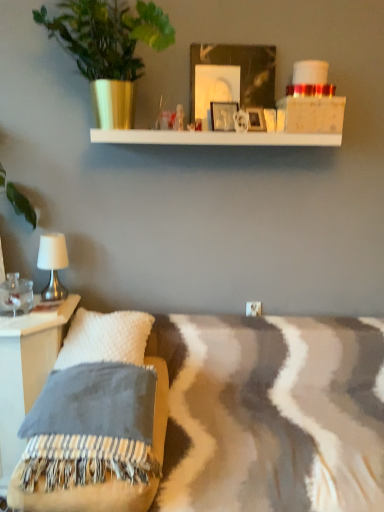
Question: From the image's perspective, is green leafy plant in gold pot at upper left located beneath white fuzzy pillow at lower left?

Choices:
 (A) yes
 (B) no

Answer: (B)

Question: Considering the relative sizes of green leafy plant in gold pot at upper left and white fuzzy pillow at lower left in the image provided, is green leafy plant in gold pot at upper left taller than white fuzzy pillow at lower left?

Choices:
 (A) no
 (B) yes

Answer: (B)

Question: Does green leafy plant in gold pot at upper left have a lesser width compared to white fuzzy pillow at lower left?

Choices:
 (A) yes
 (B) no

Answer: (B)

Question: Could you tell me if green leafy plant in gold pot at upper left is turned towards white fuzzy pillow at lower left?

Choices:
 (A) no
 (B) yes

Answer: (A)

Question: Does green leafy plant in gold pot at upper left appear on the right side of white fuzzy pillow at lower left?

Choices:
 (A) yes
 (B) no

Answer: (A)

Question: Would you say green leafy plant in gold pot at upper left is a long distance from white fuzzy pillow at lower left?

Choices:
 (A) no
 (B) yes

Answer: (B)

Question: Is silver metallic table lamp at left aimed at metallic silver picture frame at upper center, the first picture frame viewed from the right?

Choices:
 (A) yes
 (B) no

Answer: (B)

Question: Is silver metallic table lamp at left positioned before metallic silver picture frame at upper center, which appears as the 2th picture frame when viewed from the left?

Choices:
 (A) yes
 (B) no

Answer: (B)

Question: Does silver metallic table lamp at left have a smaller size compared to metallic silver picture frame at upper center, which appears as the 2th picture frame when viewed from the left?

Choices:
 (A) yes
 (B) no

Answer: (B)

Question: From a real-world perspective, is silver metallic table lamp at left on top of metallic silver picture frame at upper center, which appears as the 2th picture frame when viewed from the left?

Choices:
 (A) yes
 (B) no

Answer: (B)

Question: Would you say metallic silver picture frame at upper center, the first picture frame viewed from the right, is part of silver metallic table lamp at left's contents?

Choices:
 (A) no
 (B) yes

Answer: (A)

Question: Is the position of silver metallic table lamp at left more distant than that of metallic silver picture frame at upper center, the first picture frame viewed from the right?

Choices:
 (A) no
 (B) yes

Answer: (B)

Question: Considering the relative sizes of green leafy plant in gold pot at upper left and silver metallic table lamp at left in the image provided, is green leafy plant in gold pot at upper left taller than silver metallic table lamp at left?

Choices:
 (A) yes
 (B) no

Answer: (A)